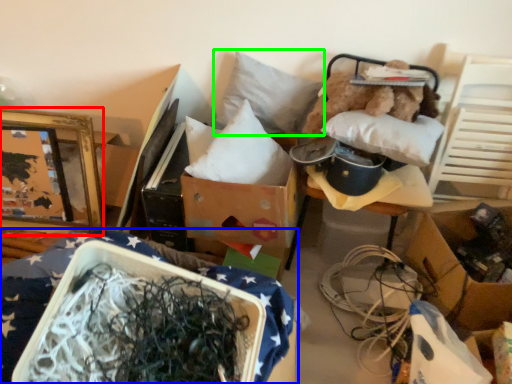
Question: Which object is positioned farthest from picture frame (highlighted by a red box)? Select from furniture (highlighted by a blue box) and pillow (highlighted by a green box).

Choices:
 (A) furniture
 (B) pillow

Answer: (A)